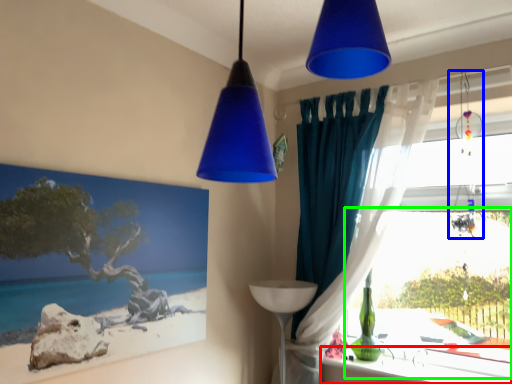
Question: Estimate the real-world distances between objects in this image. Which object is farther from window sill (highlighted by a red box), lamp (highlighted by a blue box) or bay window (highlighted by a green box)?

Choices:
 (A) lamp
 (B) bay window

Answer: (A)